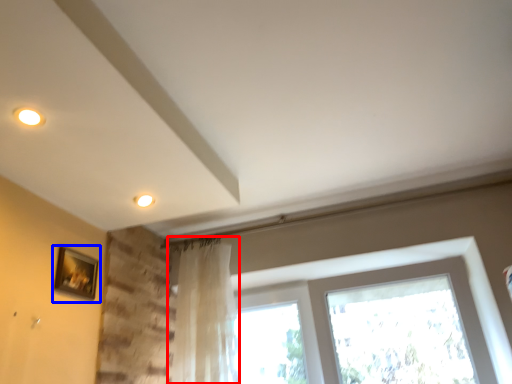
Question: Which point is further to the camera, curtain (highlighted by a red box) or picture frame (highlighted by a blue box)?

Choices:
 (A) curtain
 (B) picture frame

Answer: (A)